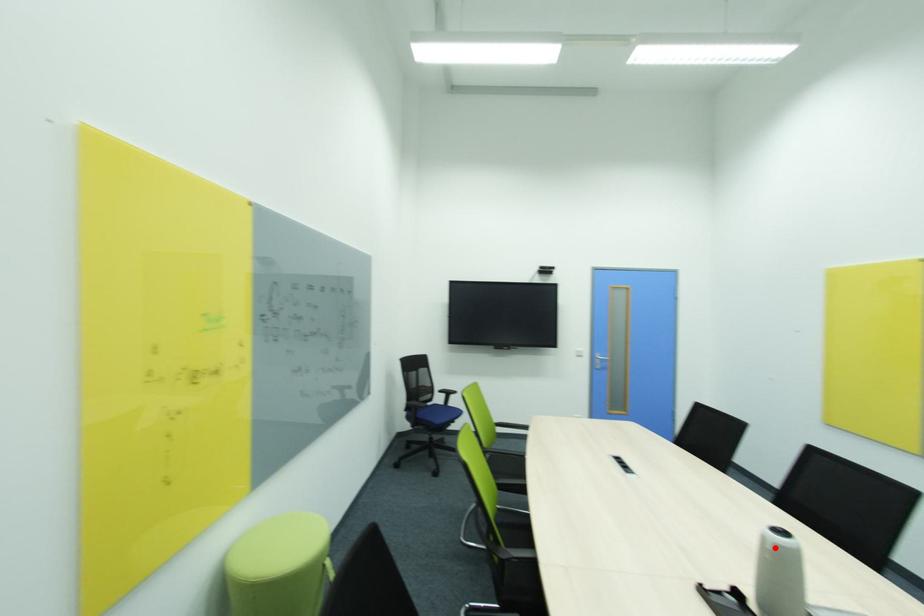
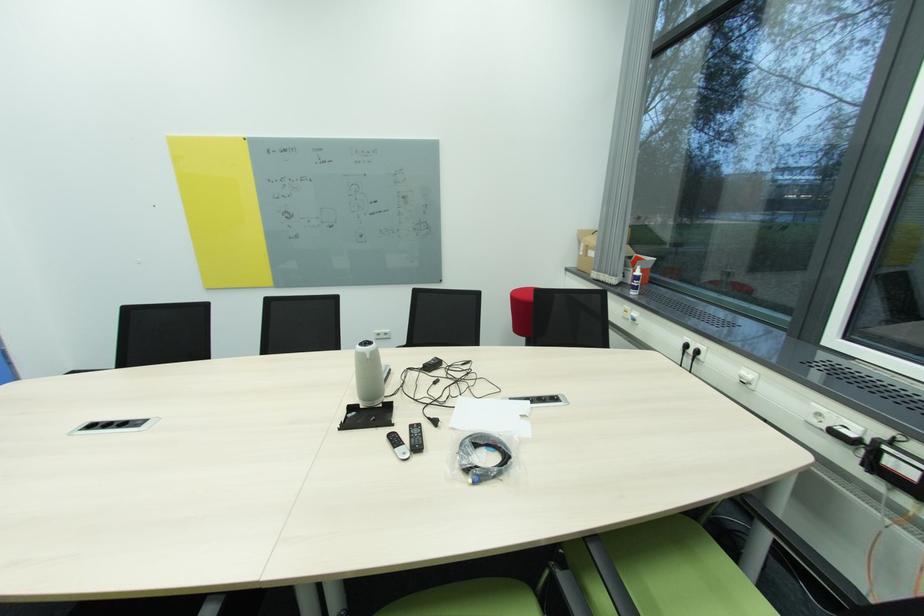
Locate, in the second image, the point that corresponds to the highlighted location in the first image.

(372, 358)